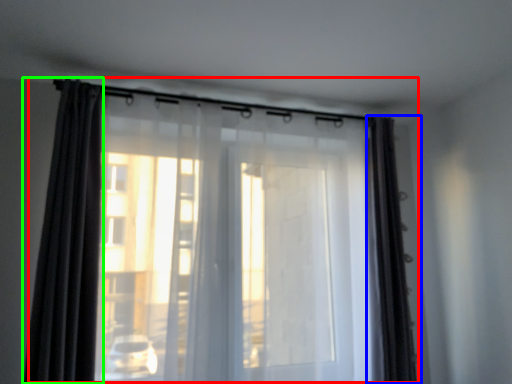
Question: Which object is positioned closest to curtain (highlighted by a red box)? Select from curtain (highlighted by a blue box) and curtain (highlighted by a green box).

Choices:
 (A) curtain
 (B) curtain

Answer: (B)